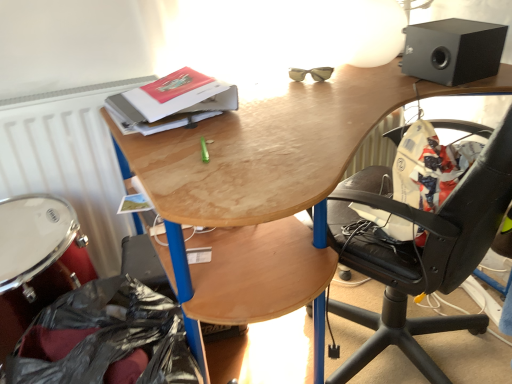
Locate an element on the screen. This screenshot has height=384, width=512. space that is in front of hardcover book at upper center is located at coordinates click(195, 142).